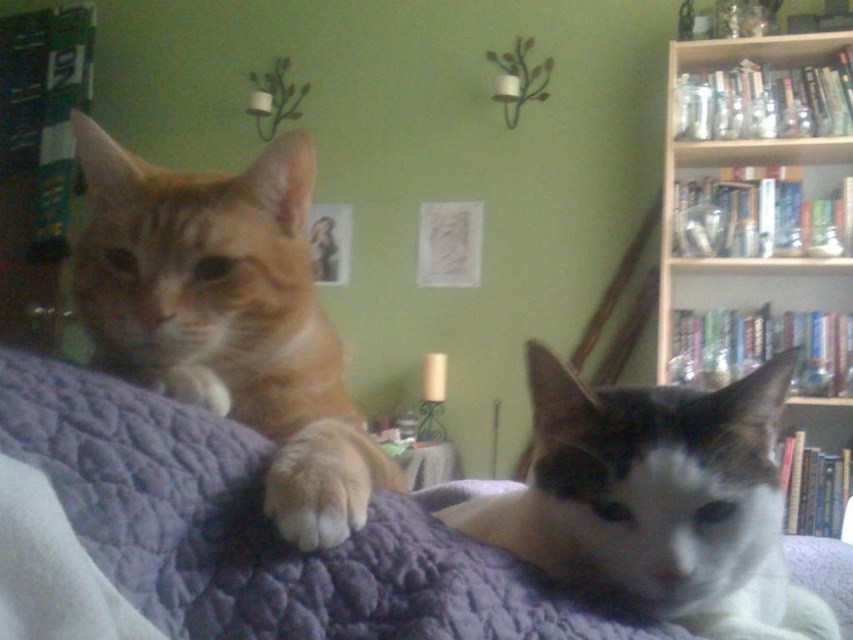
You are a photographer wanting to capture both the purple quilted bed at center and the wooden bookshelf at upper right in the same frame. Given their sizes, which object should you focus on to ensure both fit in the photo?

The purple quilted bed at center is thinner than the wooden bookshelf at upper right, so you should focus on the wooden bookshelf at upper right to ensure both fit in the photo.

You are trying to place a new toy on the purple quilted bed at center and the white fur cat at center. Since the bed is wider than the cat, where should you put the toy so both can have space?

The purple quilted bed at center is wider than the white fur cat at center, so placing the toy on the bed would provide ample space for both the cat and the toy.